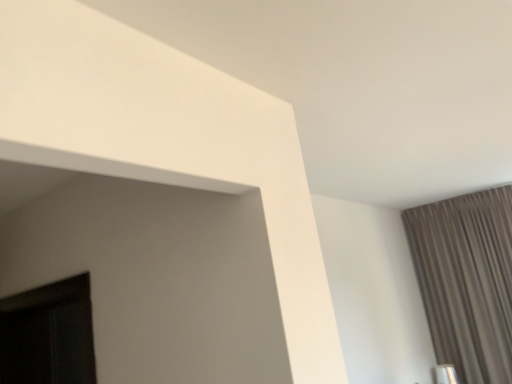
The width and height of the screenshot is (512, 384). In order to click on brown textured curtain at upper right in this screenshot , I will do `click(467, 280)`.

Describe the element at coordinates (467, 280) in the screenshot. I see `brown textured curtain at upper right` at that location.

Locate an element on the screen. This screenshot has width=512, height=384. brown textured curtain at upper right is located at coordinates (467, 280).